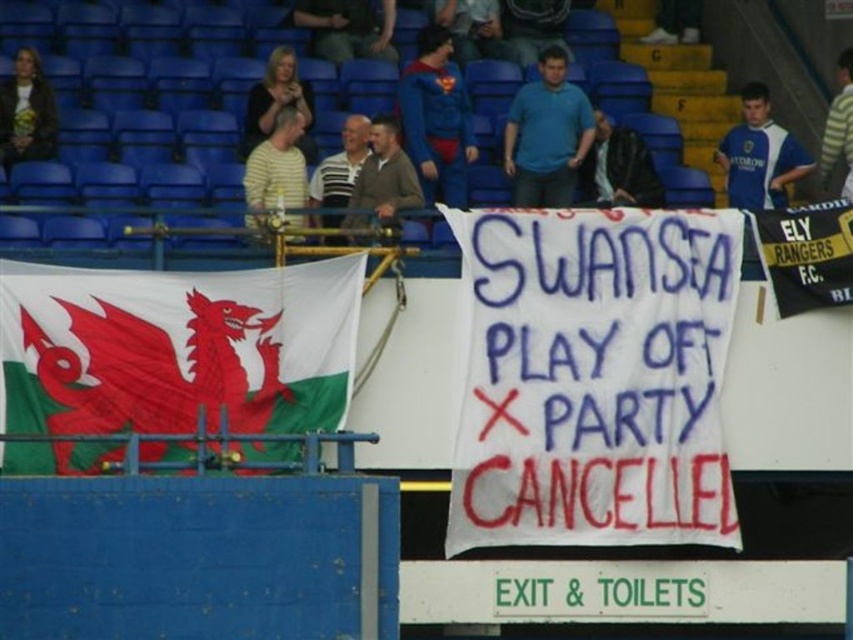
Question: Does white fabric banner at center have a lesser width compared to black jersey at right?

Choices:
 (A) no
 (B) yes

Answer: (A)

Question: Estimate the real-world distances between objects in this image. Which object is closer to the white fabric banner at center?

Choices:
 (A) white fabric flag at left
 (B) black jersey at right

Answer: (B)

Question: Among these points, which one is farthest from the camera?

Choices:
 (A) (120, 355)
 (B) (804, 257)
 (C) (643, 416)

Answer: (B)

Question: Is white fabric banner at center to the right of white fabric flag at left from the viewer's perspective?

Choices:
 (A) yes
 (B) no

Answer: (A)

Question: Which object appears closest to the camera in this image?

Choices:
 (A) white fabric flag at left
 (B) white fabric banner at center
 (C) black jersey at right

Answer: (A)

Question: Does white fabric flag at left appear under black jersey at right?

Choices:
 (A) yes
 (B) no

Answer: (A)